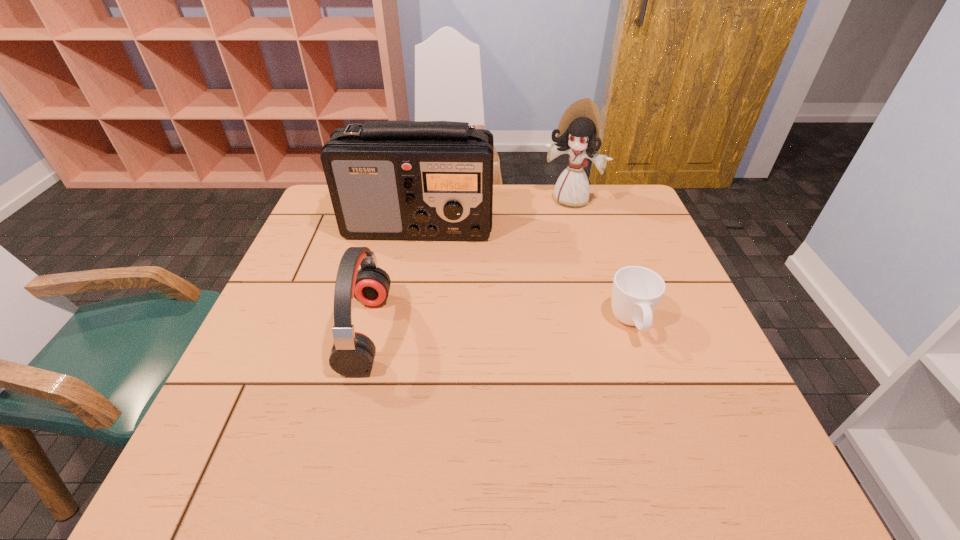
In the image, there is a desktop. Where is `free region at the near edge`? The height and width of the screenshot is (540, 960). free region at the near edge is located at coordinates (431, 395).

The width and height of the screenshot is (960, 540). I want to click on vacant region at the right edge of the desktop, so click(x=626, y=232).

You are a GUI agent. You are given a task and a screenshot of the screen. Output one action in this format:
    pyautogui.click(x=<x>, y=<y>)
    Task: Click on the vacant space at the far left corner of the desktop
    
    Given the screenshot: What is the action you would take?
    pyautogui.click(x=335, y=221)

Where is `free space that is in between the second shortest object and the cup`? free space that is in between the second shortest object and the cup is located at coordinates (499, 328).

Find the location of `free area in between the radio receiver and the shortest object`. free area in between the radio receiver and the shortest object is located at coordinates (525, 275).

I want to click on unoccupied position between the earphone and the radio receiver, so click(393, 280).

Identify the location of free space between the radio receiver and the doll. This screenshot has height=540, width=960. (494, 213).

You are a GUI agent. You are given a task and a screenshot of the screen. Output one action in this format:
    pyautogui.click(x=<x>, y=<y>)
    Task: Click on the free area in between the earphone and the doll
    The width and height of the screenshot is (960, 540).
    Given the screenshot: What is the action you would take?
    pyautogui.click(x=468, y=266)

Where is `free space between the earphone and the cup`? The image size is (960, 540). free space between the earphone and the cup is located at coordinates (499, 328).

In order to click on vacant area that lies between the shortest object and the third tallest object in this screenshot , I will do 499,328.